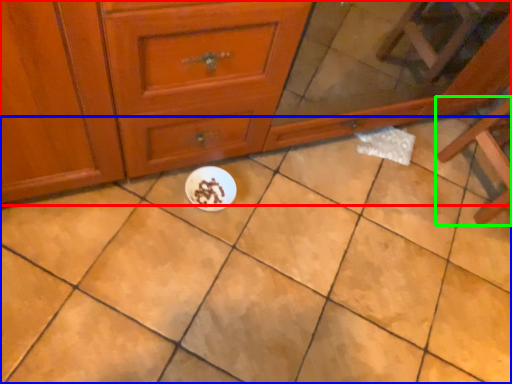
Question: Which object is the farthest from chest of drawers (highlighted by a red box)? Choose among these: ceramic tile (highlighted by a blue box) or furniture (highlighted by a green box).

Choices:
 (A) ceramic tile
 (B) furniture

Answer: (B)